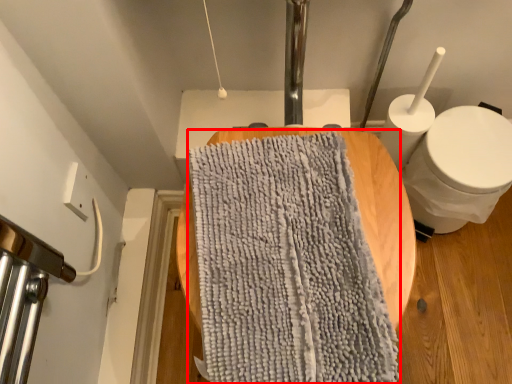
Question: From the image's perspective, what is the correct spatial positioning of bath towel (annotated by the red box) in reference to toilet?

Choices:
 (A) above
 (B) below

Answer: (B)